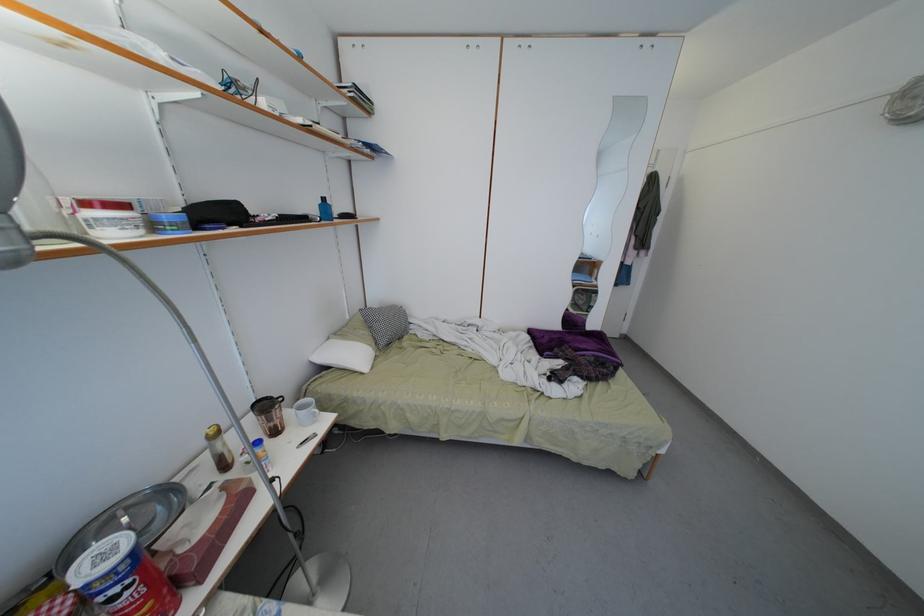
Locate an element on the screen. The width and height of the screenshot is (924, 616). flexible lamp neck is located at coordinates (224, 374).